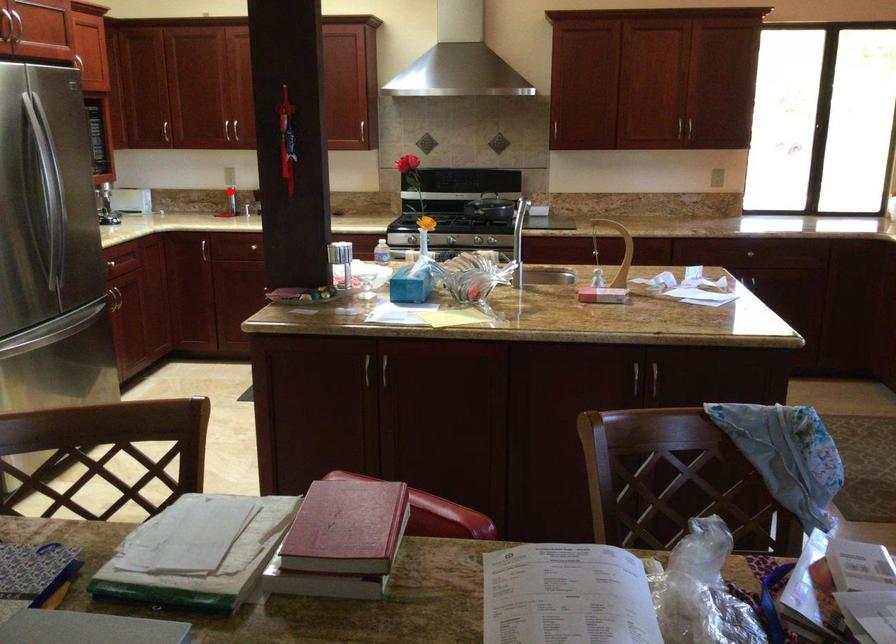
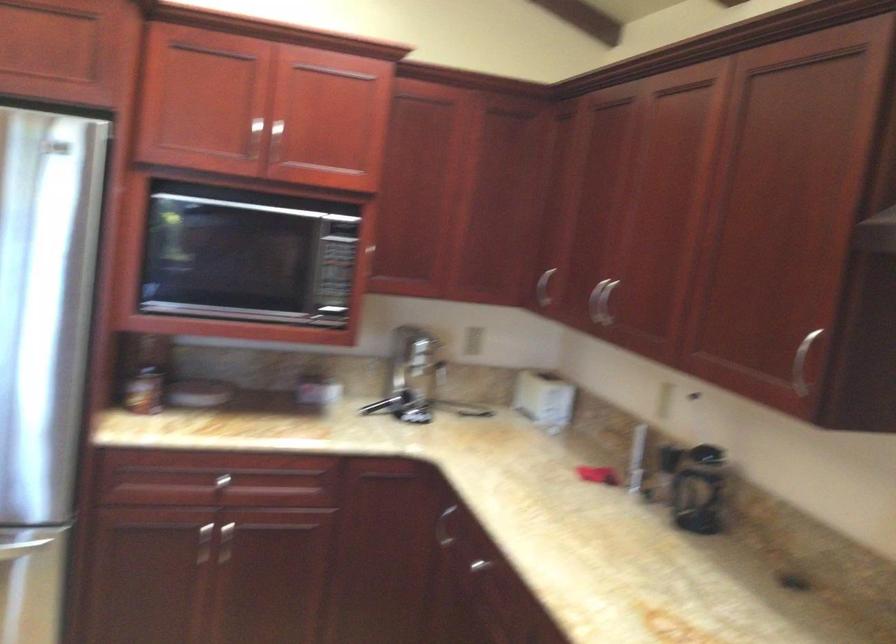
Question: A red point is marked in image1. In image2, is the corresponding 3D point closer to the camera or farther? Reply with the corresponding letter.

Choices:
 (A) The corresponding 3D point is closer.
 (B) The corresponding 3D point is farther.

Answer: (A)